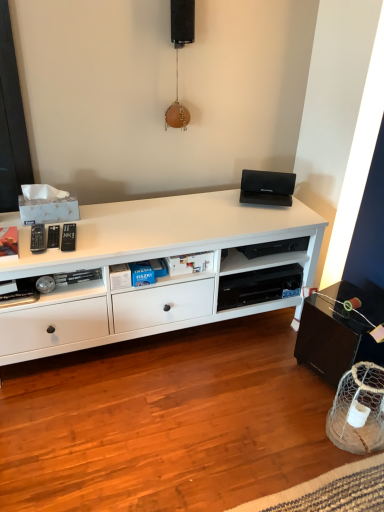
Question: In terms of size, does black matte speaker at upper center appear bigger or smaller than white matte cabinet at center?

Choices:
 (A) small
 (B) big

Answer: (A)

Question: Is black matte speaker at upper center to the left or to the right of white matte cabinet at center in the image?

Choices:
 (A) left
 (B) right

Answer: (B)

Question: Which is farther from the black matte speaker at upper center?

Choices:
 (A) black plastic shelf at center
 (B) white matte cabinet at center

Answer: (A)

Question: Considering the real-world distances, which object is closest to the black matte speaker at upper center?

Choices:
 (A) white matte cabinet at center
 (B) black plastic shelf at center

Answer: (A)